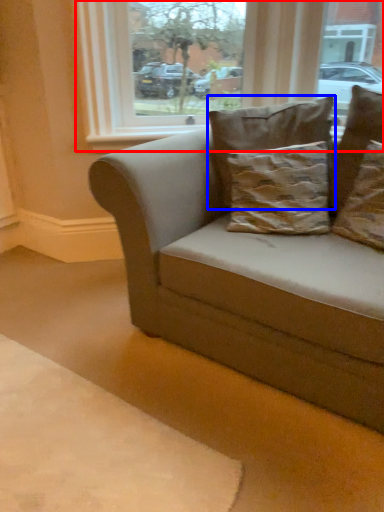
Question: Which of the following is the farthest to the observer, window (highlighted by a red box) or pillow (highlighted by a blue box)?

Choices:
 (A) window
 (B) pillow

Answer: (A)